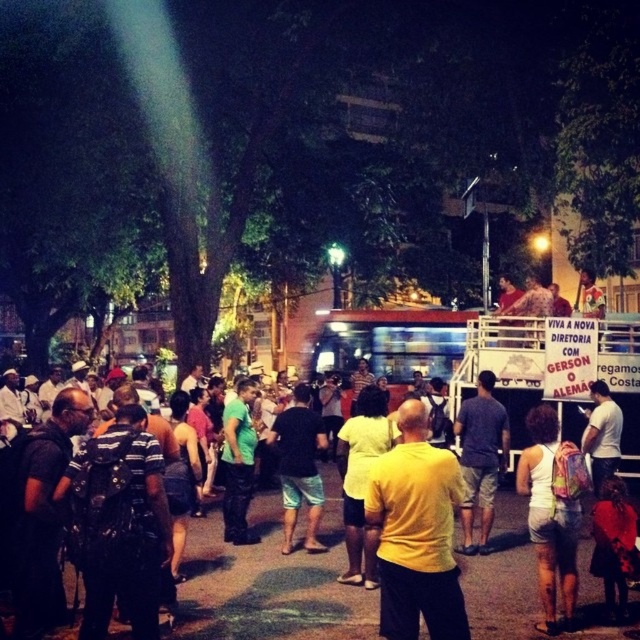
Question: Can you confirm if dark blue jeans at center is wider than white cotton tank top at center-right?

Choices:
 (A) no
 (B) yes

Answer: (A)

Question: Which point is closer to the camera?

Choices:
 (A) (320, 602)
 (B) (529, 465)

Answer: (B)

Question: Which object appears farthest from the camera in this image?

Choices:
 (A) white cotton tank top at center-right
 (B) dark blue jeans at center

Answer: (B)

Question: Is dark blue jeans at center bigger than white cotton tank top at center-right?

Choices:
 (A) no
 (B) yes

Answer: (A)

Question: Observing the image, what is the correct spatial positioning of dark blue jeans at center in reference to white cotton tank top at center-right?

Choices:
 (A) right
 (B) left

Answer: (B)

Question: Which of the following is the closest to the observer?

Choices:
 (A) (273, 566)
 (B) (525, 454)

Answer: (B)